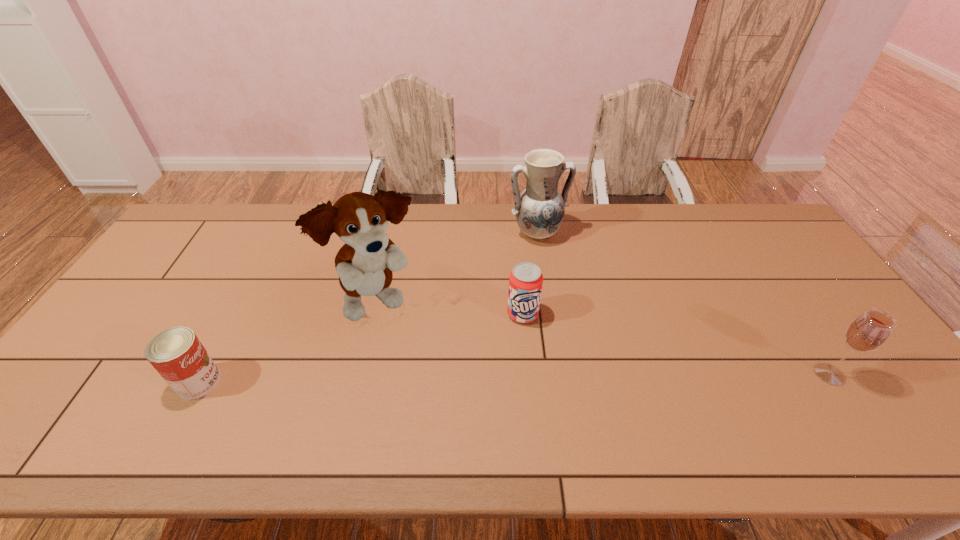
Image resolution: width=960 pixels, height=540 pixels. In order to click on can in this screenshot , I will do `click(177, 354)`.

Locate an element on the screen. This screenshot has height=540, width=960. wineglass is located at coordinates (868, 332).

Find the location of `the rightmost object`. the rightmost object is located at coordinates pyautogui.click(x=868, y=332).

At what (x,y) coordinates should I click in order to perform the action: click on soda can. Please return your answer as a coordinate pair (x, y). This screenshot has width=960, height=540. Looking at the image, I should click on (525, 281).

Identify the location of pottery. The width and height of the screenshot is (960, 540). (539, 209).

Where is `the farthest object`? the farthest object is located at coordinates (539, 209).

The width and height of the screenshot is (960, 540). What are the coordinates of `the second object from left to right` in the screenshot? It's located at (364, 264).

Find the location of a particular element. This screenshot has height=540, width=960. puppy is located at coordinates (364, 264).

Find the location of a particular element. The image size is (960, 540). free space located on the front label of the can is located at coordinates (353, 382).

Locate an element on the screen. The height and width of the screenshot is (540, 960). vacant space located 0.120m on the left of the rightmost object is located at coordinates (765, 374).